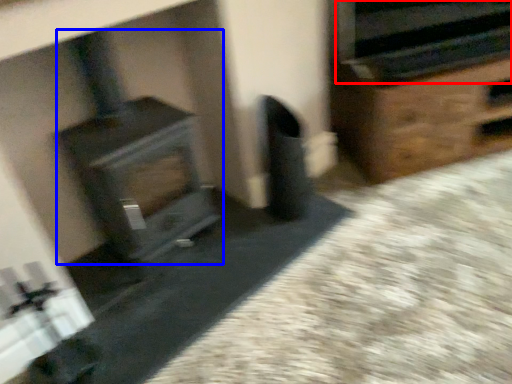
Question: Among these objects, which one is nearest to the camera, stereo (highlighted by a red box) or wood burning stove (highlighted by a blue box)?

Choices:
 (A) stereo
 (B) wood burning stove

Answer: (B)